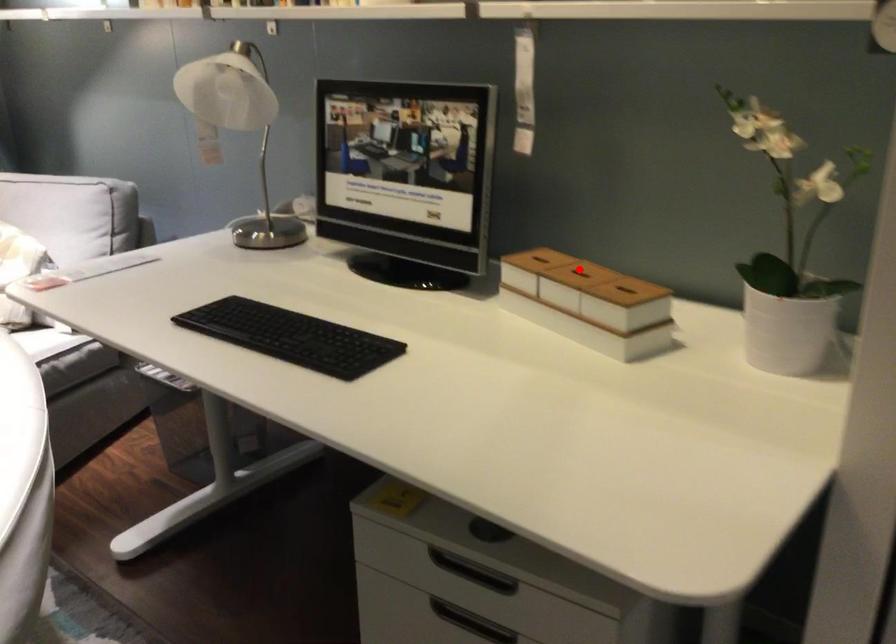
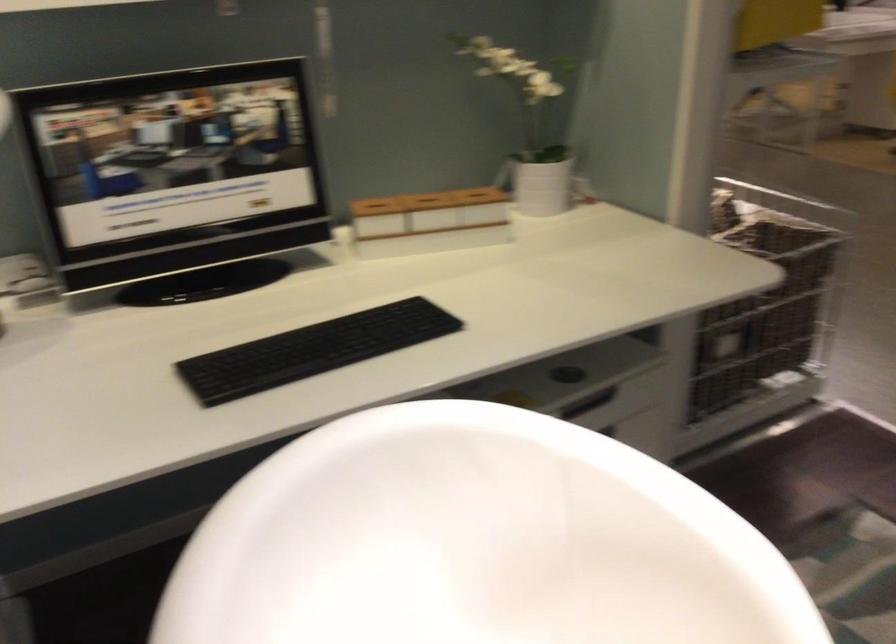
Where in the second image is the point corresponding to the highlighted location from the first image?

(426, 198)